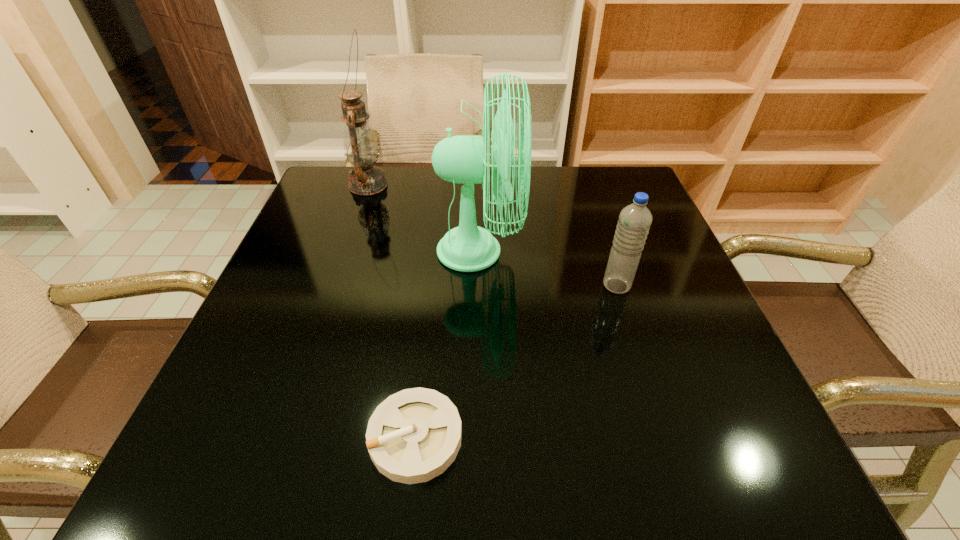
Where is `vacant area that lies between the nearest object and the fan`? vacant area that lies between the nearest object and the fan is located at coordinates tap(447, 344).

Where is `vacant area between the water bottle and the fan`? This screenshot has width=960, height=540. vacant area between the water bottle and the fan is located at coordinates (547, 268).

Locate an element on the screen. blank region between the fan and the farthest object is located at coordinates (423, 218).

This screenshot has width=960, height=540. Identify the location of vacant space that is in between the rightmost object and the shortest object. (516, 361).

Locate an element on the screen. Image resolution: width=960 pixels, height=540 pixels. unoccupied position between the oil lamp and the fan is located at coordinates (423, 218).

Select which object is the second closest to the nearest object. Please provide its 2D coordinates. Your answer should be formatted as a tuple, i.e. [(x, y)], where the tuple contains the x and y coordinates of a point satisfying the conditions above.

[(634, 222)]

Where is `object that is the second closest to the fan`? The width and height of the screenshot is (960, 540). object that is the second closest to the fan is located at coordinates (360, 145).

Where is `vacant space that satisfies the following two spatial constraints: 1. on the front side of the rightmost object; 2. on the right side of the leftmost object`? The width and height of the screenshot is (960, 540). vacant space that satisfies the following two spatial constraints: 1. on the front side of the rightmost object; 2. on the right side of the leftmost object is located at coordinates (333, 286).

Find the location of a particular element. Image resolution: width=960 pixels, height=540 pixels. vacant area that satisfies the following two spatial constraints: 1. in front of the third tallest object to blow air; 2. on the left side of the fan is located at coordinates (478, 286).

In order to click on free spot that satisfies the following two spatial constraints: 1. in front of the water bottle to blow air; 2. on the left side of the fan in this screenshot , I will do tap(478, 286).